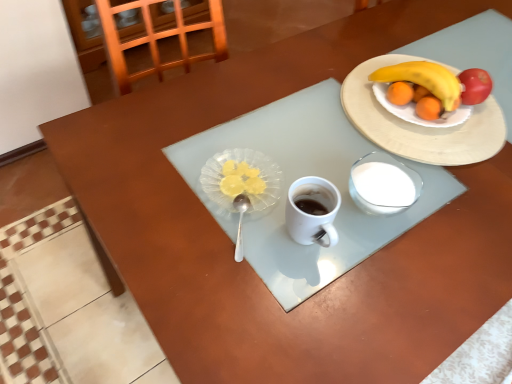
At what (x,y) coordinates should I click in order to perform the action: click on free space behind white ceramic plate at upper right. Please return your answer as a coordinate pair (x, y). Looking at the image, I should click on (420, 31).